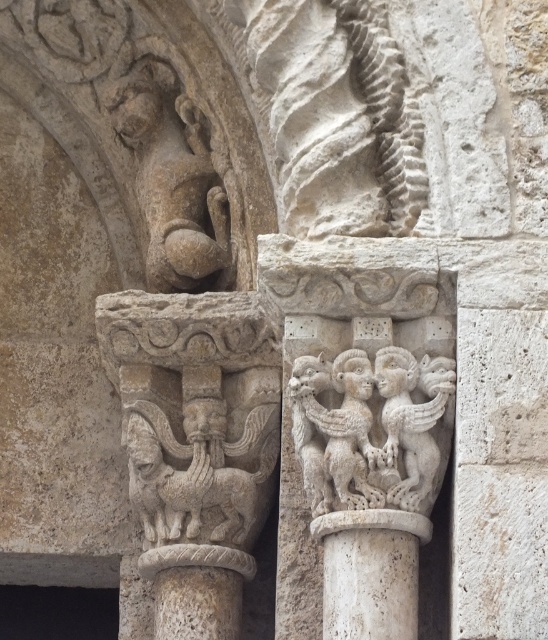
Does white stone sculpture at center have a greater height compared to carved stone gargoyle at upper left?

Correct, white stone sculpture at center is much taller as carved stone gargoyle at upper left.

Is white stone sculpture at center below carved stone gargoyle at upper left?

Yes, white stone sculpture at center is below carved stone gargoyle at upper left.

The image size is (548, 640). Describe the element at coordinates (368, 428) in the screenshot. I see `white stone sculpture at center` at that location.

Locate an element on the screen. white stone sculpture at center is located at coordinates (368, 428).

Looking at this image, can you confirm if carved stone gargoyle at upper left is positioned to the left of white stone column at center?

Correct, you'll find carved stone gargoyle at upper left to the left of white stone column at center.

Who is positioned more to the right, carved stone gargoyle at upper left or white stone column at center?

white stone column at center is more to the right.

Is point (224, 236) more distant than point (345, 598)?

Yes.

What are the coordinates of `carved stone gargoyle at upper left` in the screenshot? It's located at (172, 177).

Between point (176, 250) and point (193, 516), which one is positioned in front?

Point (193, 516) is in front.

Who is higher up, carved stone gargoyle at upper left or carved stone lion at center?

carved stone gargoyle at upper left

Locate an element on the screen. This screenshot has height=640, width=548. carved stone gargoyle at upper left is located at coordinates [172, 177].

Locate an element on the screen. The image size is (548, 640). carved stone gargoyle at upper left is located at coordinates (172, 177).